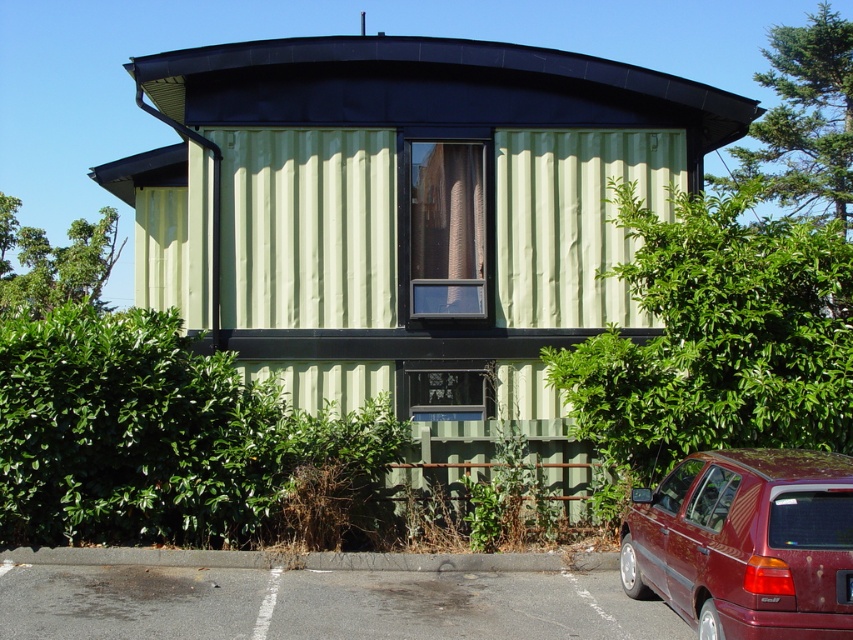
Question: Which of the following is the closest to the observer?

Choices:
 (A) shiny maroon hatchback at lower right
 (B) gray asphalt parking lot at lower left

Answer: (A)

Question: Which object is farther from the camera taking this photo?

Choices:
 (A) shiny maroon hatchback at lower right
 (B) gray asphalt parking lot at lower left

Answer: (B)

Question: Where is gray asphalt parking lot at lower left located in relation to shiny maroon hatchback at lower right in the image?

Choices:
 (A) above
 (B) below

Answer: (B)

Question: Is gray asphalt parking lot at lower left above shiny maroon hatchback at lower right?

Choices:
 (A) yes
 (B) no

Answer: (B)

Question: Can you confirm if gray asphalt parking lot at lower left is smaller than shiny maroon hatchback at lower right?

Choices:
 (A) no
 (B) yes

Answer: (B)